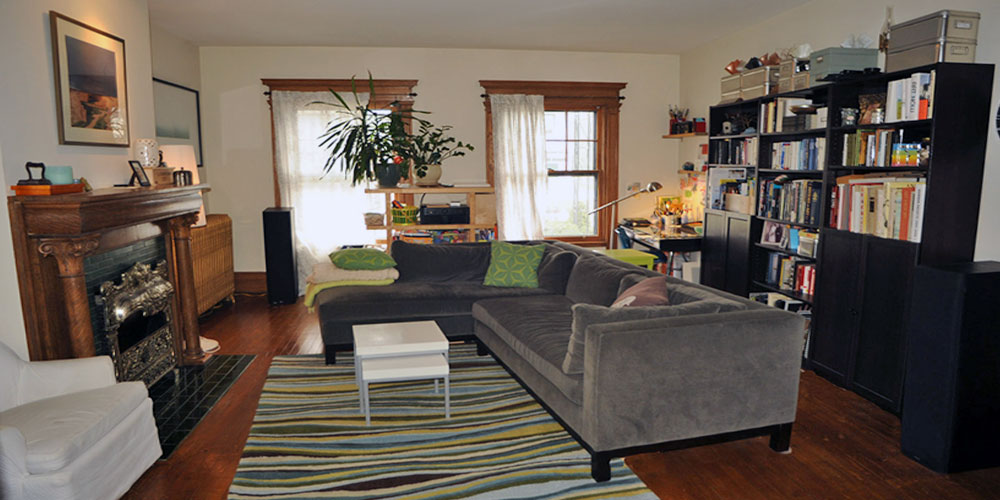
Locate an element on the screen. Image resolution: width=1000 pixels, height=500 pixels. picture is located at coordinates (85, 66).